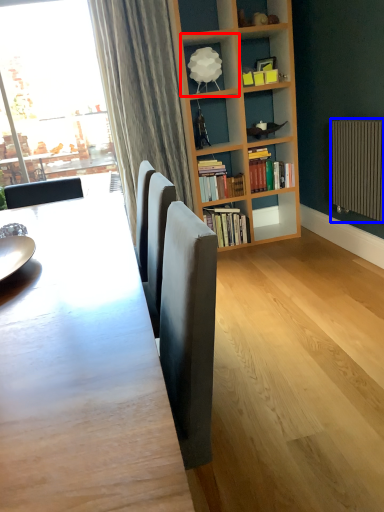
Question: Which of the following is the farthest to the observer, shelf (highlighted by a red box) or radiator (highlighted by a blue box)?

Choices:
 (A) shelf
 (B) radiator

Answer: (A)